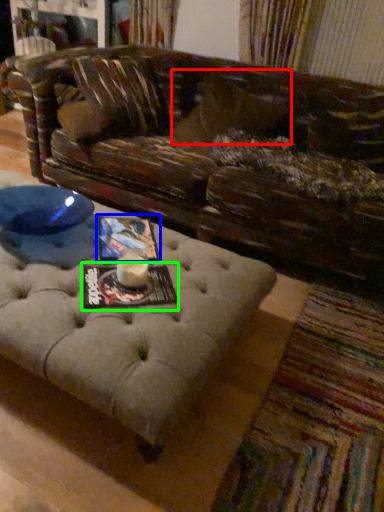
Question: Estimate the real-world distances between objects in this image. Which object is closer to pillow (highlighted by a red box), magazine (highlighted by a blue box) or magazine (highlighted by a green box)?

Choices:
 (A) magazine
 (B) magazine

Answer: (A)